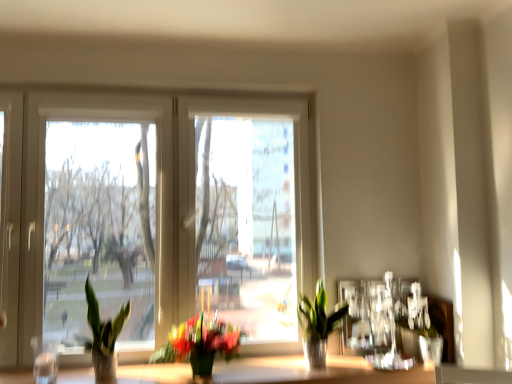
Question: Does green glossy plant at center, the first houseplant in the right-to-left sequence, come in front of smooth wooden surface at lower center?

Choices:
 (A) no
 (B) yes

Answer: (A)

Question: Does green glossy plant at center, the first houseplant in the right-to-left sequence, have a greater height compared to smooth wooden surface at lower center?

Choices:
 (A) yes
 (B) no

Answer: (A)

Question: Is green glossy plant at center, placed as the 3th houseplant when sorted from left to right, positioned far away from smooth wooden surface at lower center?

Choices:
 (A) yes
 (B) no

Answer: (B)

Question: Is green glossy plant at center, placed as the 3th houseplant when sorted from left to right, further to camera compared to smooth wooden surface at lower center?

Choices:
 (A) no
 (B) yes

Answer: (B)

Question: Does green glossy plant at center, placed as the 3th houseplant when sorted from left to right, have a lesser width compared to smooth wooden surface at lower center?

Choices:
 (A) no
 (B) yes

Answer: (B)

Question: Could you tell me if green glossy plant at center, the first houseplant in the right-to-left sequence, is turned towards smooth wooden surface at lower center?

Choices:
 (A) yes
 (B) no

Answer: (B)

Question: Could you tell me if smooth wooden surface at lower center is turned towards white plastic window at center?

Choices:
 (A) yes
 (B) no

Answer: (B)

Question: Can you confirm if smooth wooden surface at lower center is positioned to the right of white plastic window at center?

Choices:
 (A) yes
 (B) no

Answer: (A)

Question: From the image's perspective, is smooth wooden surface at lower center located beneath white plastic window at center?

Choices:
 (A) yes
 (B) no

Answer: (A)

Question: Does smooth wooden surface at lower center have a greater width compared to white plastic window at center?

Choices:
 (A) no
 (B) yes

Answer: (B)

Question: From a real-world perspective, does smooth wooden surface at lower center sit lower than white plastic window at center?

Choices:
 (A) yes
 (B) no

Answer: (A)

Question: From the image's perspective, is smooth wooden surface at lower center on top of white plastic window at center?

Choices:
 (A) no
 (B) yes

Answer: (A)

Question: Is green glossy plant at center, the first houseplant in the right-to-left sequence, located outside green matte plant at center, positioned as the 2th houseplant in right-to-left order?

Choices:
 (A) yes
 (B) no

Answer: (A)